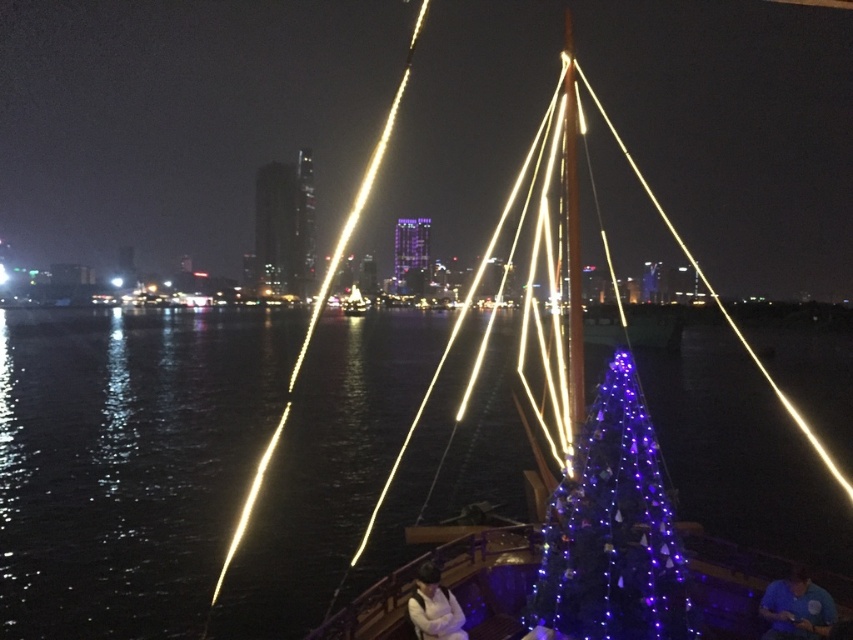
Can you confirm if purple glossy christmas tree at center is positioned above metallic gold mast at center?

No.

Is point (544, 548) more distant than point (576, 186)?

No, it is not.

The height and width of the screenshot is (640, 853). What are the coordinates of `purple glossy christmas tree at center` in the screenshot? It's located at (613, 529).